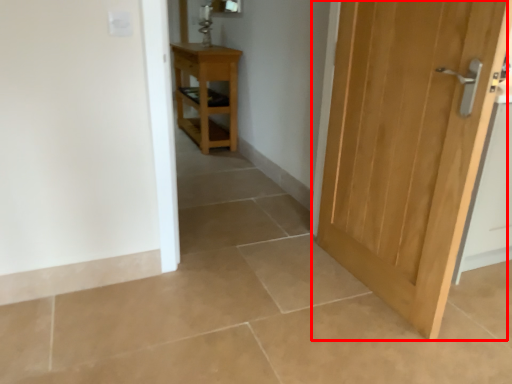
Question: From the image's perspective, what is the correct spatial positioning of door (annotated by the red box) in reference to nightstand?

Choices:
 (A) above
 (B) below

Answer: (B)